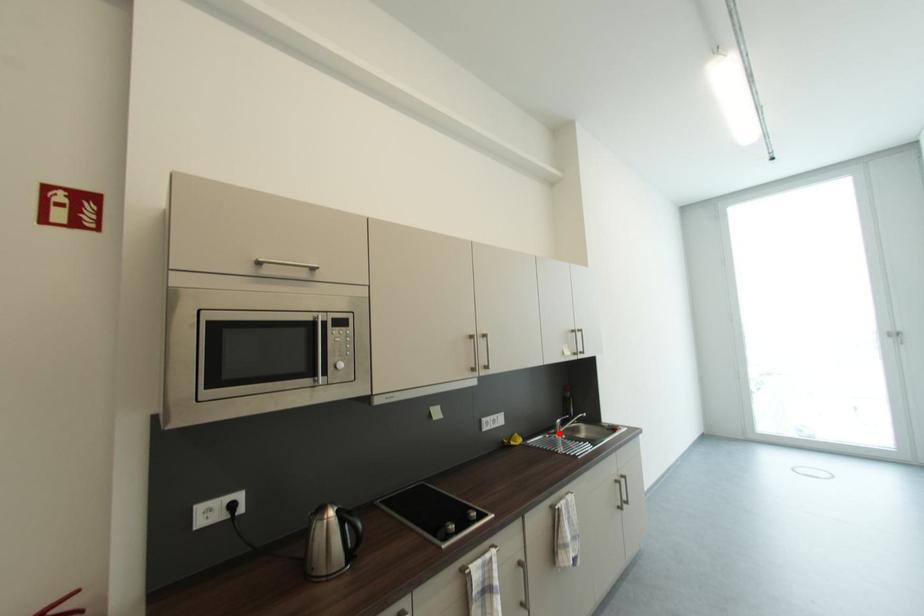
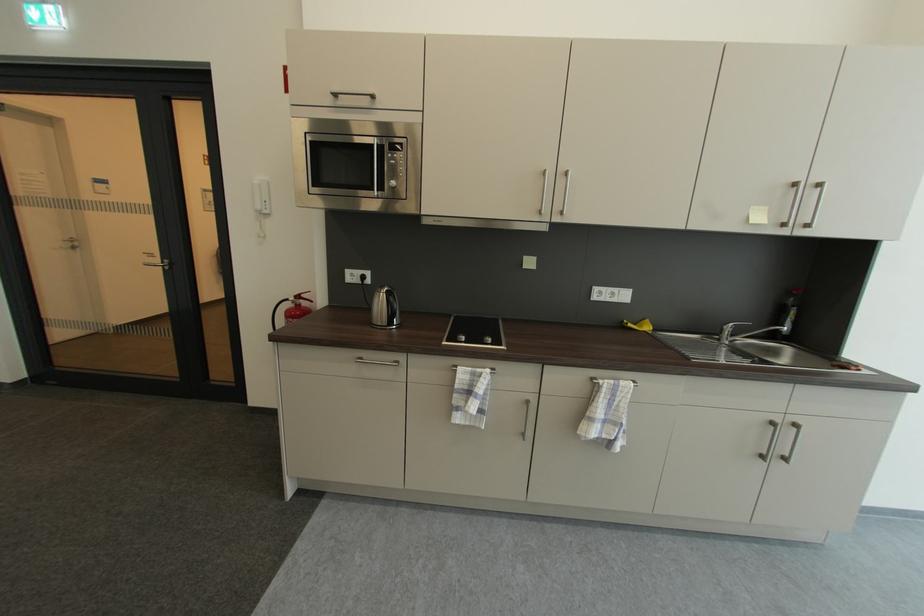
In the second image, find the point that corresponds to the highlighted location in the first image.

(723, 339)